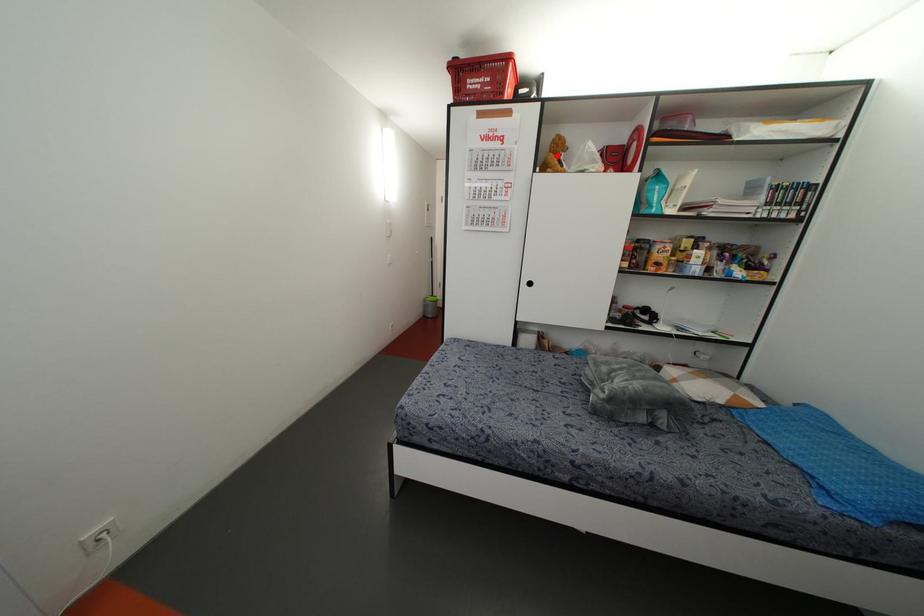
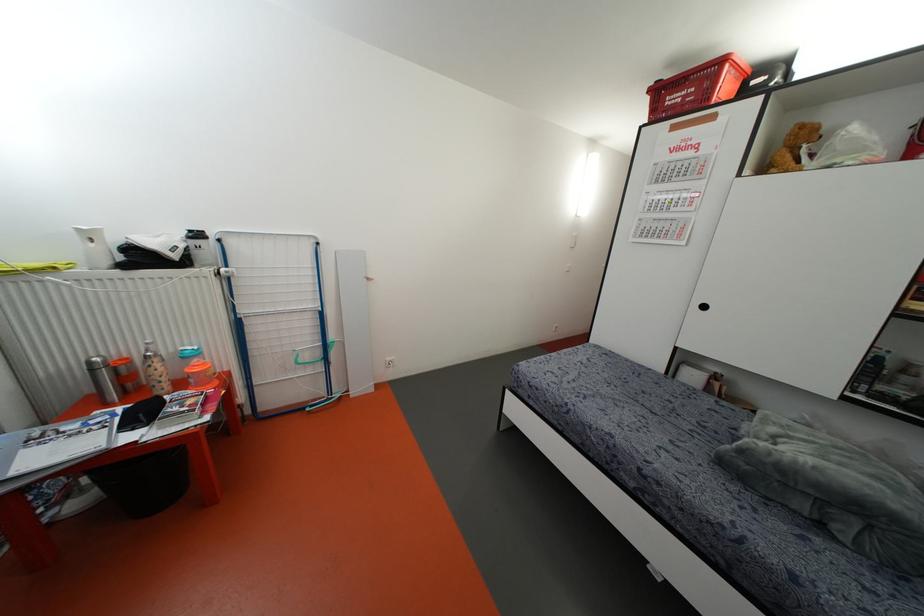
In the second image, find the point that corresponds to the highlighted location in the first image.

(796, 150)